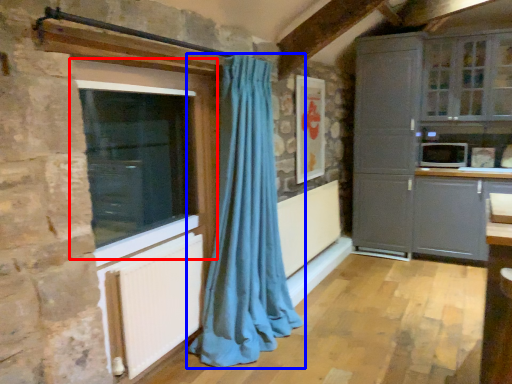
Question: Which of the following is the closest to the observer, window (highlighted by a red box) or curtain (highlighted by a blue box)?

Choices:
 (A) window
 (B) curtain

Answer: (A)